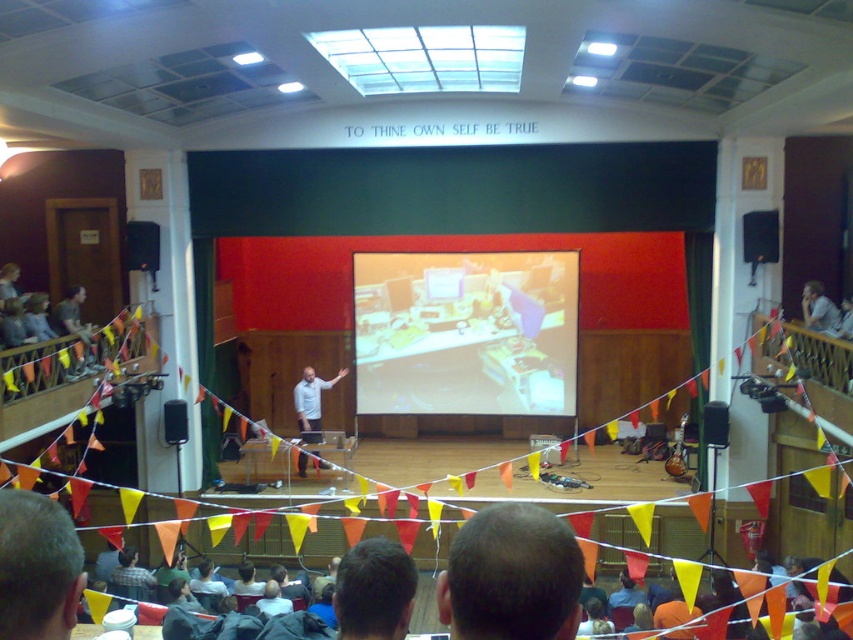
You are sitting in the auditorium and looking at the stage. There are two points marked on the projection screen. One is at coordinate point [433,291] and the other is at point [767,221]. Which point is closer to you?

Point [433,291] is closer to you because it is further to the viewer than point [767,221].

You are an event organizer setting up the stage. You need to move the black plastic speaker at left to the back of the stage. Which direction should you move it relative to the black plastic speaker at center?

The black plastic speaker at left is currently in front of the black plastic speaker at center, so to move it to the back of the stage, you should move it behind the black plastic speaker at center.